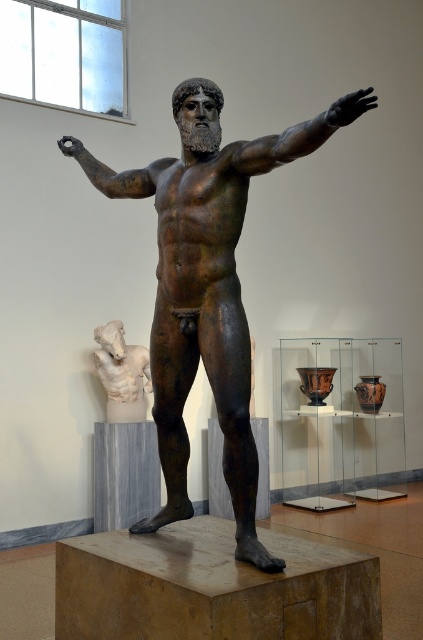
You are an art conservator standing 10 feet away from the statue. You need to reach the bronze muscular arm at upper center to clean it. Can you reach it without moving closer?

The bronze muscular arm at upper center is 7.05 feet away from the camera. Since you are standing 10 feet away, you are farther than the required distance, so you cannot reach it without moving closer.

You are an art conservator assessing the placement of objects in the room. The bronze muscular arm at upper center and the white marble head at left are both in view. Which object is closer to the viewer?

The bronze muscular arm at upper center is closer to the viewer as it is in front of the white marble head at left.